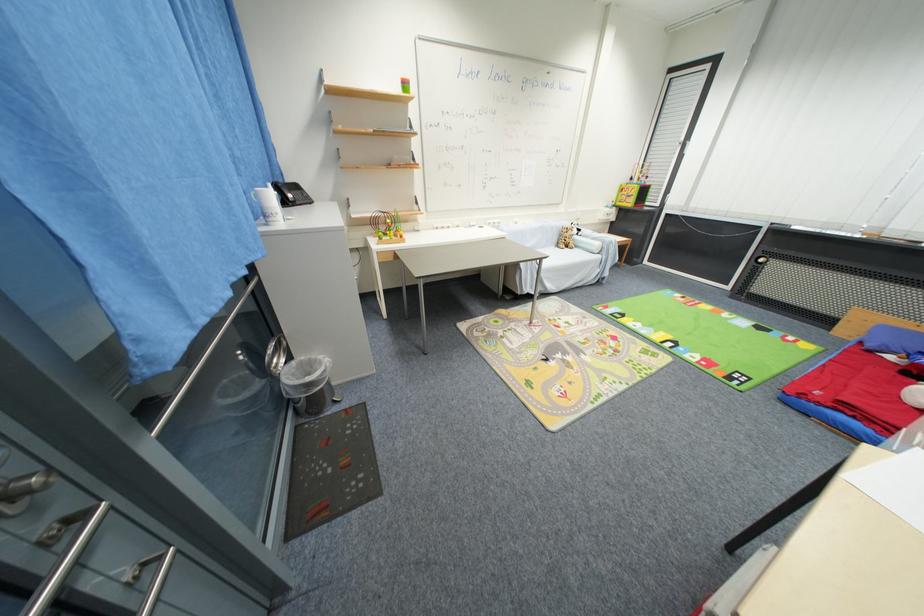
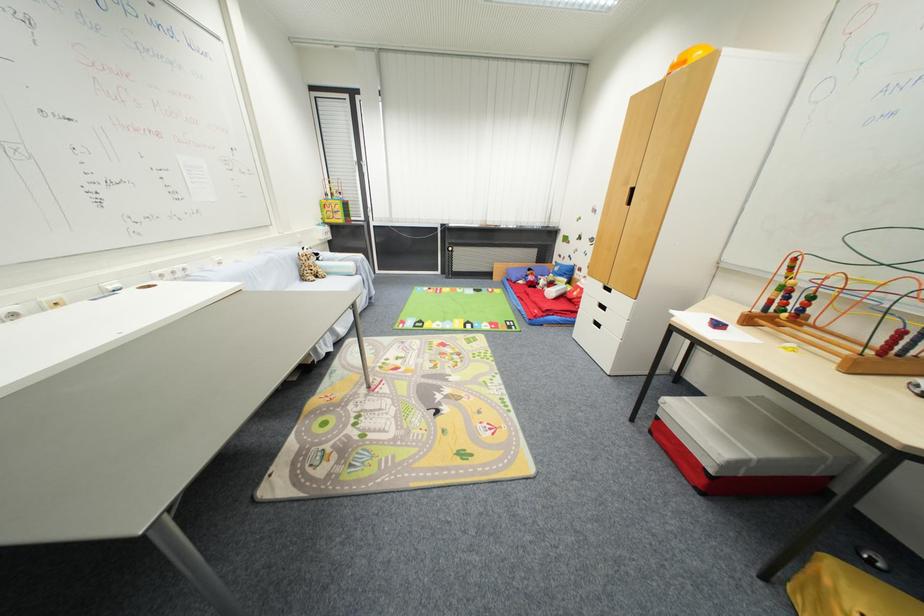
Where in the second image is the point corresponding to point 569,244 from the first image?

(313, 274)